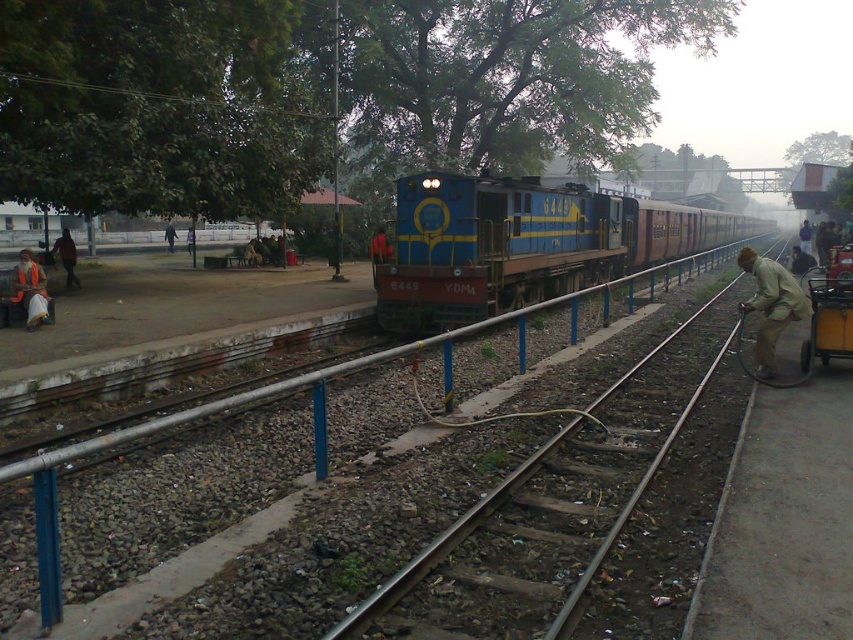
Question: Does light brown fabric at right appear under dark blue fabric person at center?

Choices:
 (A) yes
 (B) no

Answer: (A)

Question: Estimate the real-world distances between objects in this image. Which object is closer to the light brown fabric at right?

Choices:
 (A) dark blue fabric person at center
 (B) yellow plastic cart at right

Answer: (B)

Question: Which object is closer to the camera taking this photo?

Choices:
 (A) light brown fabric bag at center
 (B) dark blue fabric person at center
 (C) dark brown leather jacket at left
 (D) red fabric bag at center

Answer: (D)

Question: Does blue painted metal train at center appear on the right side of light brown fabric at right?

Choices:
 (A) no
 (B) yes

Answer: (B)

Question: Which point is farther to the camera?

Choices:
 (A) (26, 326)
 (B) (381, 257)

Answer: (B)

Question: Is dark brown leather jacket at left to the right of dark blue fabric person at center from the viewer's perspective?

Choices:
 (A) no
 (B) yes

Answer: (B)